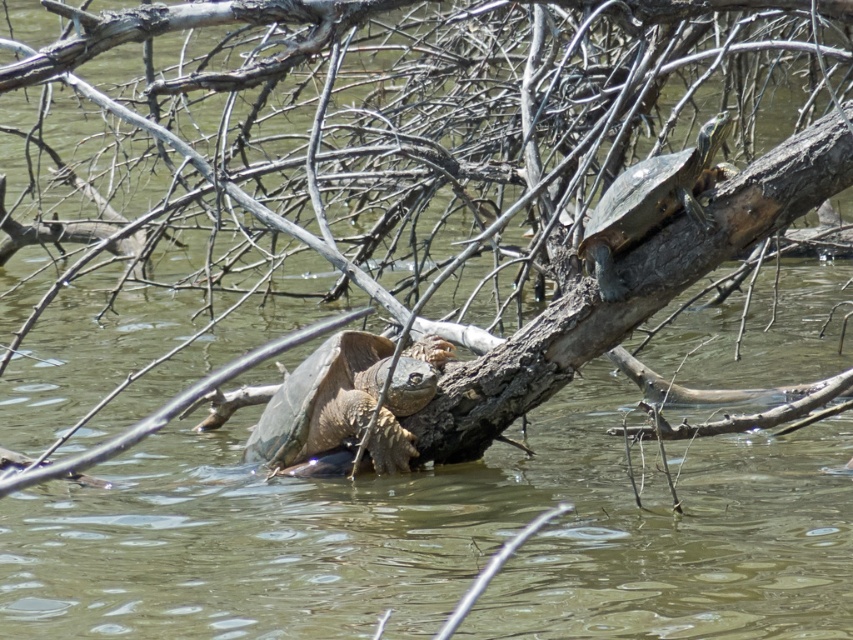
You are a wildlife photographer aiming to capture closeup shots of both the leathery brown tortoise at center and the smooth brown tortoise at upper right. Since your camera has a fixed focus range of 30 cm, can you determine which tortoise is within the focus range if you position yourself directly in front of the branch?

The leathery brown tortoise at center is larger in width than the smooth brown tortoise at upper right. Since the camera has a fixed focus range of 30 cm, the photographer must ensure the tortoise is within that distance. However, the description does not provide the actual distance between the photographer and the tortoises, so it is impossible to determine if either is within the focus range based on the given information.

You are a wildlife photographer aiming to capture a closeup of both the leathery brown tortoise at center and the smooth brown tortoise at upper right. Since you want to ensure both are in focus, you need to know which one is closer to the water surface. Based on the scene, which tortoise is positioned higher above the water?

The smooth brown tortoise at upper right is positioned higher above the water since the leathery brown tortoise at center has a lesser height compared to it.